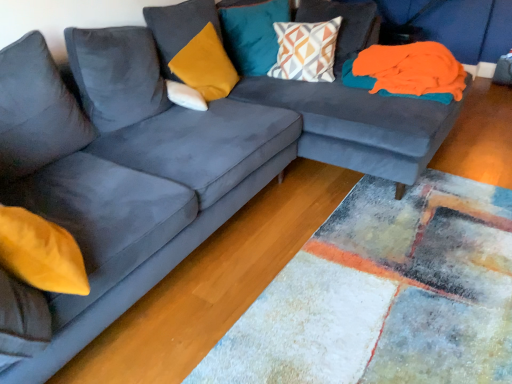
Question: From a real-world perspective, is teal velvet cushion at upper center, acting as the second pillow starting from the right, positioned over geometric-patterned fabric pillow at upper center, arranged as the first pillow when viewed from the right, based on gravity?

Choices:
 (A) yes
 (B) no

Answer: (A)

Question: Is there a large distance between teal velvet cushion at upper center, acting as the second pillow starting from the right, and geometric-patterned fabric pillow at upper center, which is counted as the 4th pillow, starting from the left?

Choices:
 (A) no
 (B) yes

Answer: (A)

Question: Is teal velvet cushion at upper center, positioned as the 3th pillow in left-to-right order, smaller than geometric-patterned fabric pillow at upper center, arranged as the first pillow when viewed from the right?

Choices:
 (A) yes
 (B) no

Answer: (A)

Question: Is teal velvet cushion at upper center, acting as the second pillow starting from the right, next to geometric-patterned fabric pillow at upper center, which is counted as the 4th pillow, starting from the left, and touching it?

Choices:
 (A) yes
 (B) no

Answer: (B)

Question: Is the position of teal velvet cushion at upper center, acting as the second pillow starting from the right, more distant than that of geometric-patterned fabric pillow at upper center, arranged as the first pillow when viewed from the right?

Choices:
 (A) yes
 (B) no

Answer: (A)

Question: Based on their positions, is teal velvet cushion at upper center, acting as the second pillow starting from the right, located to the left or right of geometric-patterned fabric pillow at upper center, arranged as the first pillow when viewed from the right?

Choices:
 (A) left
 (B) right

Answer: (A)

Question: From the image's perspective, is teal velvet cushion at upper center, acting as the second pillow starting from the right, positioned above or below geometric-patterned fabric pillow at upper center, arranged as the first pillow when viewed from the right?

Choices:
 (A) above
 (B) below

Answer: (A)

Question: From a real-world perspective, is teal velvet cushion at upper center, positioned as the 3th pillow in left-to-right order, above or below geometric-patterned fabric pillow at upper center, arranged as the first pillow when viewed from the right?

Choices:
 (A) above
 (B) below

Answer: (A)

Question: Is teal velvet cushion at upper center, positioned as the 3th pillow in left-to-right order, in front of or behind geometric-patterned fabric pillow at upper center, which is counted as the 4th pillow, starting from the left, in the image?

Choices:
 (A) front
 (B) behind

Answer: (B)

Question: From their relative heights in the image, would you say velvet mustard pillow at upper center, the 3th pillow from the right, is taller or shorter than teal velvet cushion at upper center, acting as the second pillow starting from the right?

Choices:
 (A) short
 (B) tall

Answer: (A)

Question: From a real-world perspective, relative to teal velvet cushion at upper center, acting as the second pillow starting from the right, is velvet mustard pillow at upper center, marked as the 2th pillow in a left-to-right arrangement, vertically above or below?

Choices:
 (A) below
 (B) above

Answer: (A)

Question: Considering their positions, is velvet mustard pillow at upper center, the 3th pillow from the right, located in front of or behind teal velvet cushion at upper center, positioned as the 3th pillow in left-to-right order?

Choices:
 (A) front
 (B) behind

Answer: (A)

Question: Is velvet mustard pillow at upper center, the 3th pillow from the right, to the left or to the right of teal velvet cushion at upper center, acting as the second pillow starting from the right, in the image?

Choices:
 (A) right
 (B) left

Answer: (B)

Question: Looking at their shapes, would you say orange fabric at upper right is wider or thinner than white soft pillow at center, arranged as the fourth pillow when viewed from the right?

Choices:
 (A) wide
 (B) thin

Answer: (A)

Question: In terms of height, does orange fabric at upper right look taller or shorter compared to white soft pillow at center, arranged as the fourth pillow when viewed from the right?

Choices:
 (A) tall
 (B) short

Answer: (B)